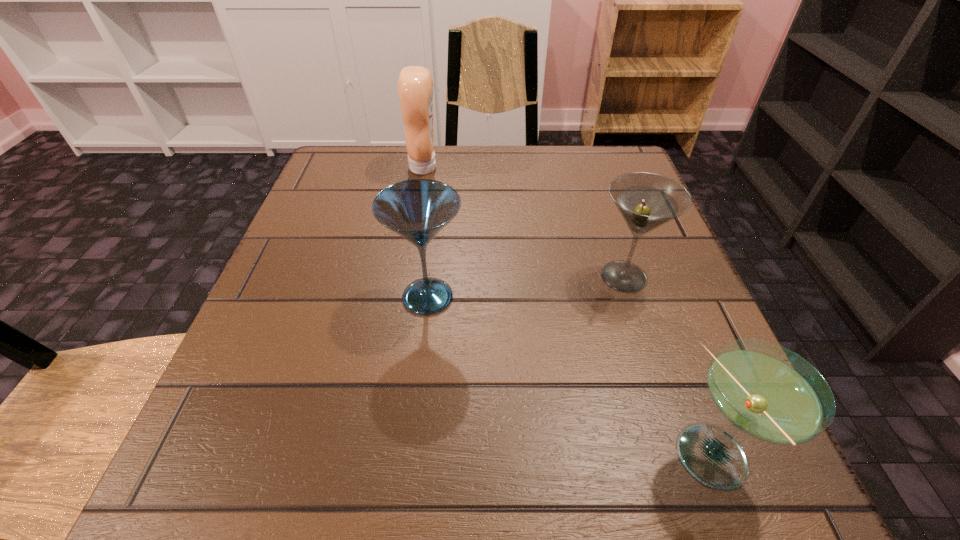
The image size is (960, 540). I want to click on free space at the near edge of the desktop, so click(554, 506).

Identify the location of free location at the left edge of the desktop. This screenshot has height=540, width=960. (214, 397).

In the image, there is a desktop. In order to click on free space at the right edge in this screenshot , I will do `click(671, 409)`.

This screenshot has width=960, height=540. Identify the location of free location at the far left corner of the desktop. (351, 154).

This screenshot has height=540, width=960. I want to click on free location at the far right corner of the desktop, so click(x=619, y=170).

Where is `vacant space that is in between the farthest object and the nearest martini`? This screenshot has height=540, width=960. vacant space that is in between the farthest object and the nearest martini is located at coordinates (568, 313).

Choose which object is the second nearest neighbor to the nearest martini. Please provide its 2D coordinates. Your answer should be formatted as a tuple, i.e. [(x, y)], where the tuple contains the x and y coordinates of a point satisfying the conditions above.

[(418, 209)]

Image resolution: width=960 pixels, height=540 pixels. What are the coordinates of `object that is the closest to the nearest object` in the screenshot? It's located at (646, 201).

Find the location of a particular element. The image size is (960, 540). martini that is the second closest to the farthest object is located at coordinates (646, 201).

You are a GUI agent. You are given a task and a screenshot of the screen. Output one action in this format:
    pyautogui.click(x=<x>, y=<y>)
    Task: Click on the martini that can be found as the third closest to the condiment
    
    Given the screenshot: What is the action you would take?
    pyautogui.click(x=770, y=393)